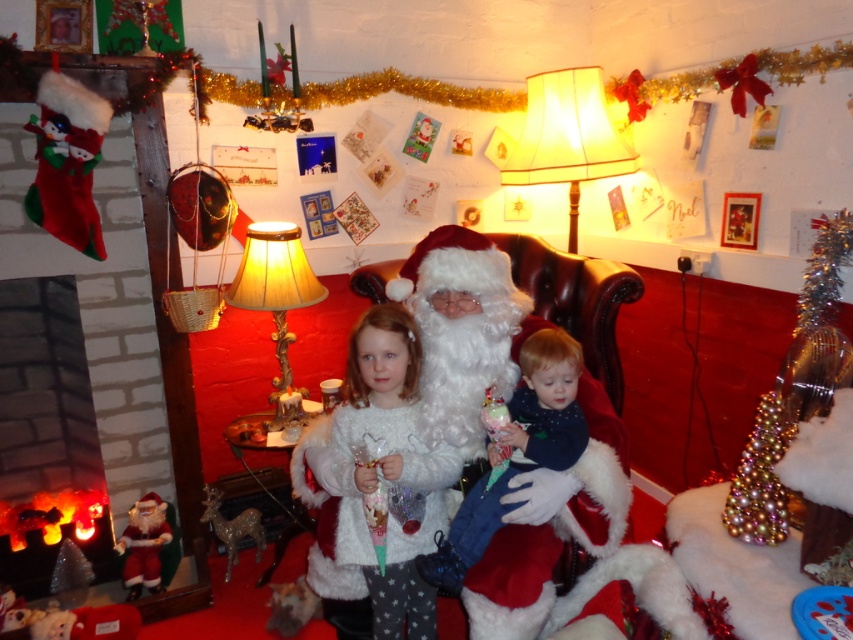
Between white fluffy sweater at center and shiny metallic tinsel at right, which one appears on the left side from the viewer's perspective?

From the viewer's perspective, white fluffy sweater at center appears more on the left side.

The height and width of the screenshot is (640, 853). I want to click on white fluffy sweater at center, so click(x=380, y=476).

Does point (36, 589) come farther from viewer compared to point (529, 371)?

Yes, it is behind point (529, 371).

The height and width of the screenshot is (640, 853). I want to click on brick fireplace at left, so click(x=44, y=392).

Image resolution: width=853 pixels, height=640 pixels. What do you see at coordinates (460, 330) in the screenshot?
I see `white fluffy santa at center` at bounding box center [460, 330].

Who is taller, white fluffy santa at center or fluffy white blanket at center?

Standing taller between the two is white fluffy santa at center.

Between point (434, 374) and point (514, 413), which one is positioned behind?

The point (514, 413) is behind.

Find the location of a particular element. white fluffy santa at center is located at coordinates coord(460,330).